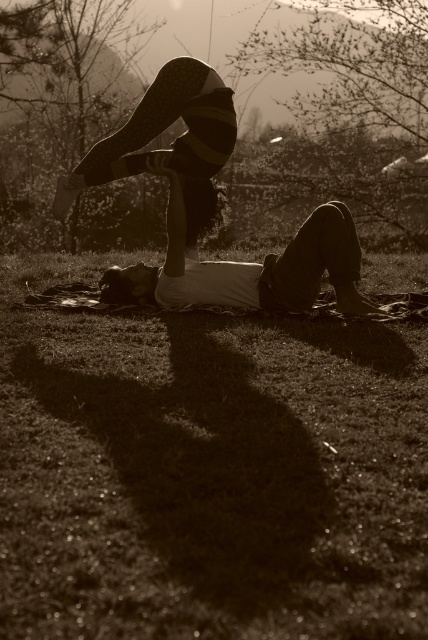
Question: Observing the image, what is the correct spatial positioning of matte black pants at center in reference to striped leggings at upper center?

Choices:
 (A) below
 (B) above

Answer: (A)

Question: Which is nearer to the matte black pants at center?

Choices:
 (A) striped leggings at upper center
 (B) green grass at lower center

Answer: (A)

Question: Among these objects, which one is nearest to the camera?

Choices:
 (A) green grass at lower center
 (B) striped leggings at upper center

Answer: (A)

Question: Does green grass at lower center have a smaller size compared to striped leggings at upper center?

Choices:
 (A) no
 (B) yes

Answer: (A)

Question: Is matte black pants at center smaller than striped leggings at upper center?

Choices:
 (A) yes
 (B) no

Answer: (B)

Question: Considering the real-world distances, which object is farthest from the matte black pants at center?

Choices:
 (A) green grass at lower center
 (B) striped leggings at upper center

Answer: (A)